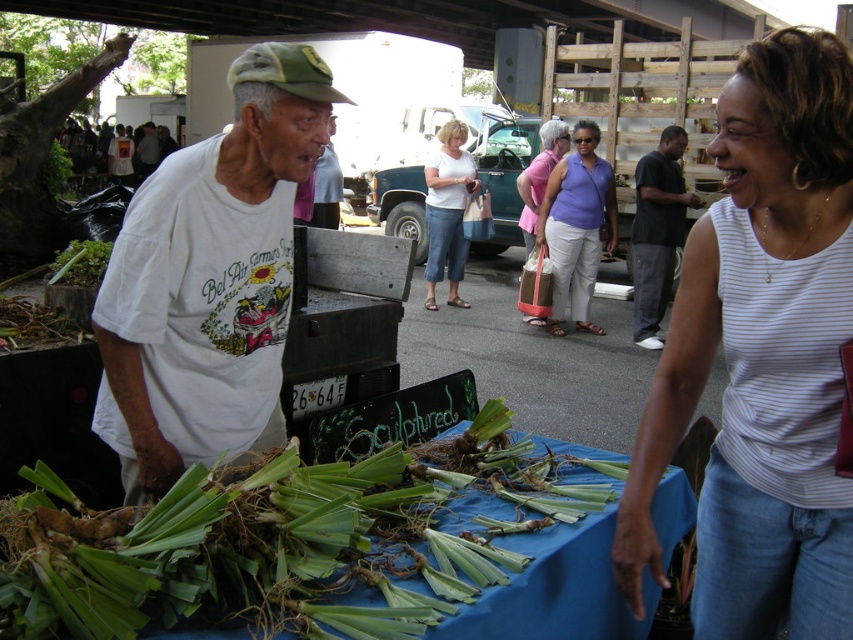
Is purple fabric shirt at center smaller than dark gray shirt at center?

Correct, purple fabric shirt at center occupies less space than dark gray shirt at center.

Describe the element at coordinates (576, 225) in the screenshot. Image resolution: width=853 pixels, height=640 pixels. I see `purple fabric shirt at center` at that location.

Where is `purple fabric shirt at center`? The image size is (853, 640). purple fabric shirt at center is located at coordinates (576, 225).

Measure the distance between white striped tank top at upper right and camera.

white striped tank top at upper right is 4.15 feet from camera.

Image resolution: width=853 pixels, height=640 pixels. I want to click on white striped tank top at upper right, so click(x=762, y=356).

The height and width of the screenshot is (640, 853). Describe the element at coordinates (762, 356) in the screenshot. I see `white striped tank top at upper right` at that location.

Is white striped tank top at upper right to the right of purple fabric shirt at center from the viewer's perspective?

No, white striped tank top at upper right is not to the right of purple fabric shirt at center.

The width and height of the screenshot is (853, 640). What do you see at coordinates (762, 356) in the screenshot?
I see `white striped tank top at upper right` at bounding box center [762, 356].

Locate an element on the screen. This screenshot has height=640, width=853. white striped tank top at upper right is located at coordinates (762, 356).